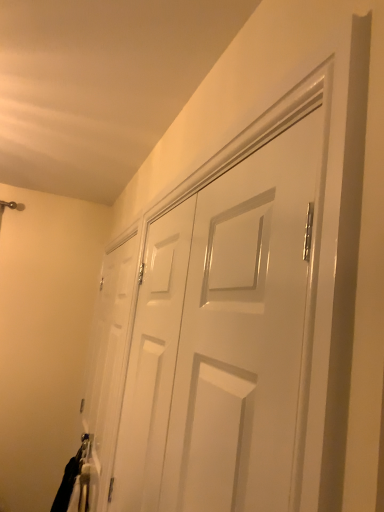
Question: Considering the positions of black fabric laundry at lower left and white glossy door at center, the 2th door viewed from the right, in the image, is black fabric laundry at lower left taller or shorter than white glossy door at center, the 2th door viewed from the right,?

Choices:
 (A) short
 (B) tall

Answer: (A)

Question: From a real-world perspective, is black fabric laundry at lower left above or below white glossy door at center, arranged as the first door when viewed from the back?

Choices:
 (A) above
 (B) below

Answer: (B)

Question: Based on their relative distances, which object is farther from the black fabric laundry at lower left?

Choices:
 (A) white glossy door at center, which is counted as the first door, starting from the left
 (B) white glossy door at center, the first door in the right-to-left sequence

Answer: (B)

Question: Considering the real-world distances, which object is farthest from the white glossy door at center, the 2th door in the back-to-front sequence?

Choices:
 (A) black fabric laundry at lower left
 (B) white glossy door at center, which is the 2th door from front to back

Answer: (A)